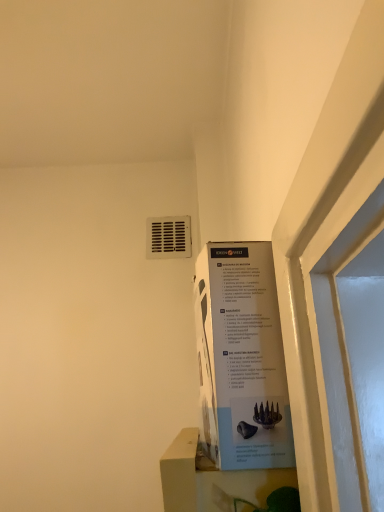
Question: Does white matte window sill at lower center come in front of white cardboard poster at upper right?

Choices:
 (A) yes
 (B) no

Answer: (A)

Question: Can you confirm if white matte window sill at lower center is wider than white cardboard poster at upper right?

Choices:
 (A) yes
 (B) no

Answer: (A)

Question: From the image's perspective, is white matte window sill at lower center below white cardboard poster at upper right?

Choices:
 (A) yes
 (B) no

Answer: (A)

Question: Is white matte window sill at lower center positioned behind white cardboard poster at upper right?

Choices:
 (A) yes
 (B) no

Answer: (B)

Question: Is white matte window sill at lower center in contact with white cardboard poster at upper right?

Choices:
 (A) yes
 (B) no

Answer: (B)

Question: Considering the positions of white matte window sill at lower center and white cardboard poster at upper right in the image, is white matte window sill at lower center bigger or smaller than white cardboard poster at upper right?

Choices:
 (A) small
 (B) big

Answer: (B)

Question: Would you say white matte window sill at lower center is to the left or to the right of white cardboard poster at upper right in the picture?

Choices:
 (A) right
 (B) left

Answer: (B)

Question: Considering the positions of point (187, 429) and point (256, 395), is point (187, 429) closer or farther from the camera than point (256, 395)?

Choices:
 (A) farther
 (B) closer

Answer: (A)

Question: Considering the positions of white matte window sill at lower center and white cardboard poster at upper right in the image, is white matte window sill at lower center wider or thinner than white cardboard poster at upper right?

Choices:
 (A) wide
 (B) thin

Answer: (A)

Question: Choose the correct answer: Is white plastic vent at upper center inside white cardboard poster at upper right or outside it?

Choices:
 (A) outside
 (B) inside

Answer: (A)

Question: From a real-world perspective, relative to white cardboard poster at upper right, is white plastic vent at upper center vertically above or below?

Choices:
 (A) above
 (B) below

Answer: (A)

Question: Considering the relative positions of white plastic vent at upper center and white cardboard poster at upper right in the image provided, is white plastic vent at upper center to the left or to the right of white cardboard poster at upper right?

Choices:
 (A) right
 (B) left

Answer: (B)

Question: Relative to white cardboard poster at upper right, is white plastic vent at upper center in front or behind?

Choices:
 (A) front
 (B) behind

Answer: (B)

Question: Looking at their shapes, would you say white plastic vent at upper center is wider or thinner than white matte window sill at lower center?

Choices:
 (A) thin
 (B) wide

Answer: (A)

Question: From the image's perspective, is white plastic vent at upper center located above or below white matte window sill at lower center?

Choices:
 (A) above
 (B) below

Answer: (A)